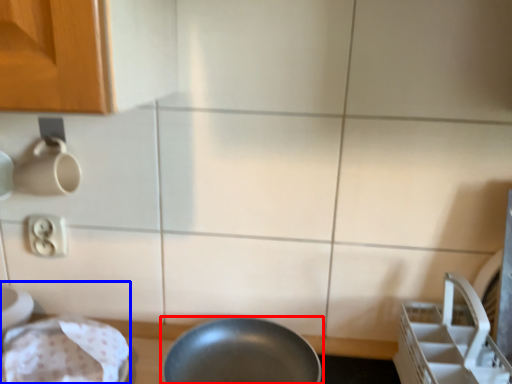
Question: Which point is further to the camera, frying pan (highlighted by a red box) or sink (highlighted by a blue box)?

Choices:
 (A) frying pan
 (B) sink

Answer: (A)